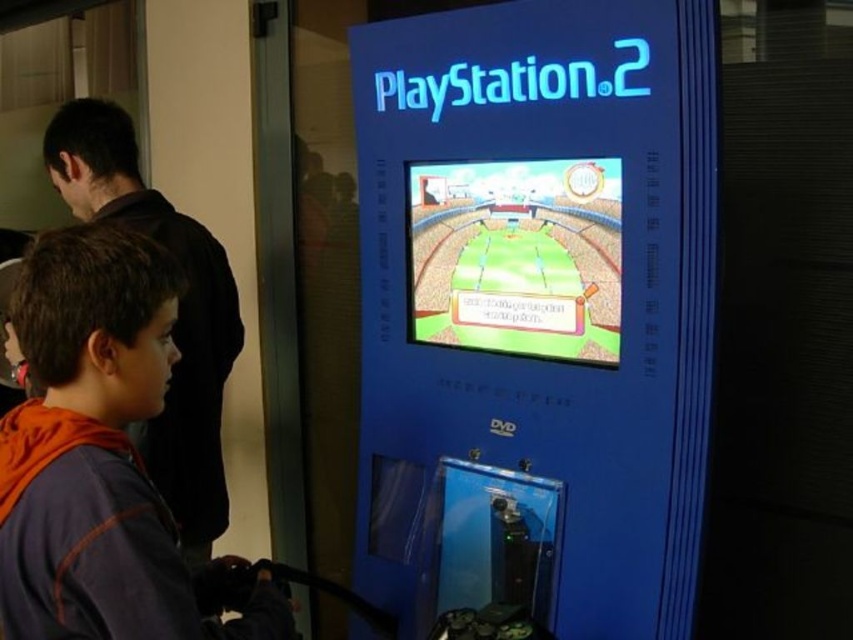
You are a visitor at an arcade and want to play the soccer game on the cartoonish plastic soccer field at center. However, you notice the blue plastic playstation 2 at center is blocking your view. Can you see the soccer field clearly from your current position?

The blue plastic playstation 2 at center is in front of the cartoonish plastic soccer field at center, so it is blocking your view. You cannot see the soccer field clearly from your current position.

You are standing in front of the PlayStation 2 gaming kiosk and see two points marked on the screen. The first point is at coordinates point (x=619, y=545) and the second point is at point (x=490, y=172). Which point is closer to you?

Point (x=619, y=545) is closer to the camera than point (x=490, y=172).